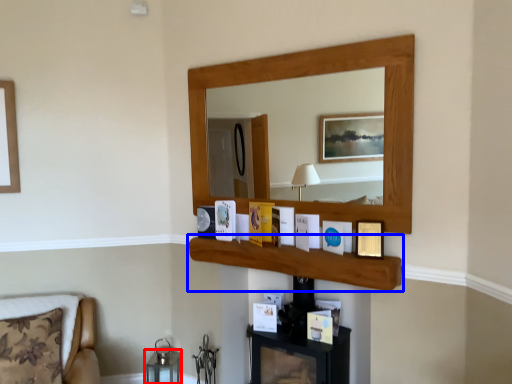
Question: Which point is further to the camera, table (highlighted by a red box) or cabinet (highlighted by a blue box)?

Choices:
 (A) table
 (B) cabinet

Answer: (A)